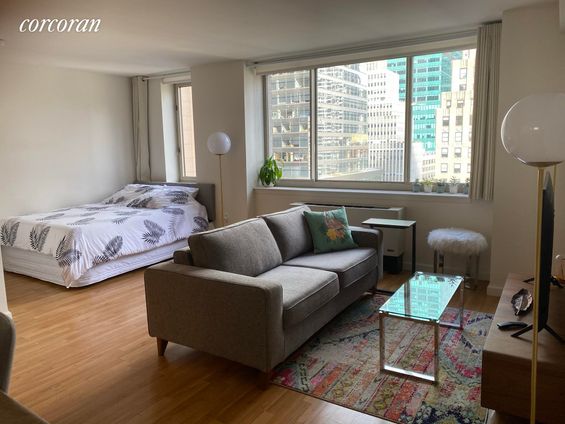
Where is `wooden surface top`? The width and height of the screenshot is (565, 424). wooden surface top is located at coordinates (503, 350).